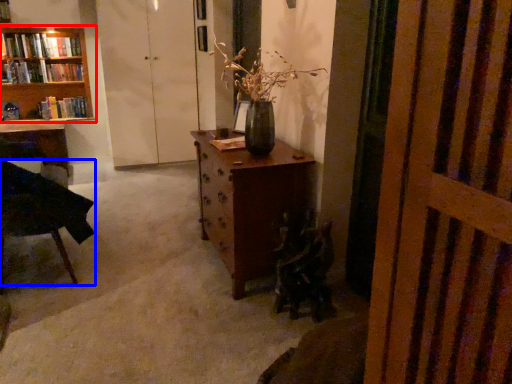
Question: Among these objects, which one is farthest to the camera, bookcase (highlighted by a red box) or chair (highlighted by a blue box)?

Choices:
 (A) bookcase
 (B) chair

Answer: (A)